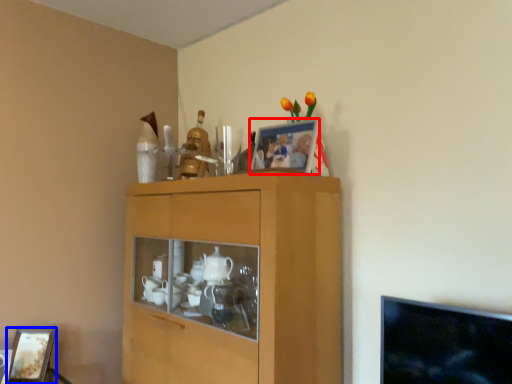
Question: Which point is closer to the camera, picture frame (highlighted by a red box) or picture frame (highlighted by a blue box)?

Choices:
 (A) picture frame
 (B) picture frame

Answer: (A)